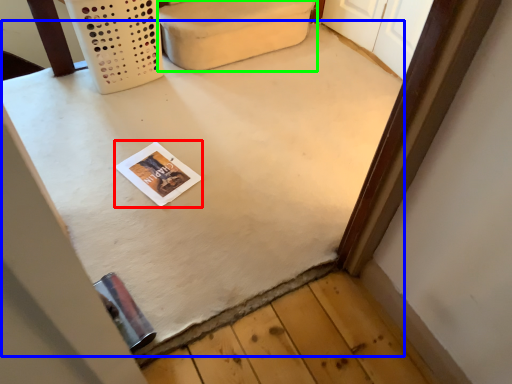
Question: Estimate the real-world distances between objects in this image. Which object is closer to magazine (highlighted by a red box), table (highlighted by a blue box) or furniture (highlighted by a green box)?

Choices:
 (A) table
 (B) furniture

Answer: (A)